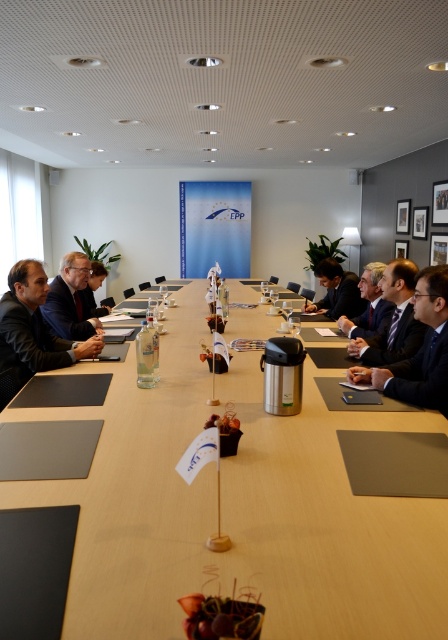
You are a photographer in the conference room and want to capture both the dark blue suit at center and the matte black suit at center in a single frame. Based on their positions, which suit is closer to the camera?

The dark blue suit at center is located below the matte black suit at center, so the matte black suit at center is closer to the camera.

You are a photographer standing at the back of the conference room. You want to take a photo of the wooden table at center and the matte black suit at center such that both are clearly visible. Based on their positions, which object should be placed to the right side in the frame?

The wooden table at center is positioned on the right side of matte black suit at center, so in the frame, the wooden table at center should be on the right side.

You are attending a meeting in the conference room and need to pass a document to the person wearing the dark blue suit at center and the matte black suit at center. Which one can you reach without moving from your current position?

The dark blue suit at center is closer to the viewer than the matte black suit at center, so you can reach the person wearing the dark blue suit at center without moving, but you might need to move to reach the matte black suit at center.